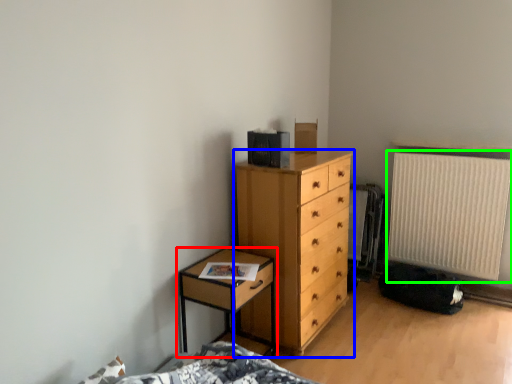
Question: Which is farther away from nightstand (highlighted by a red box)? chest of drawers (highlighted by a blue box) or radiator (highlighted by a green box)?

Choices:
 (A) chest of drawers
 (B) radiator

Answer: (B)